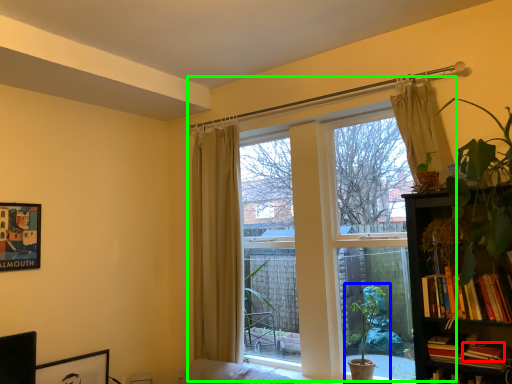
Question: Which object is positioned farthest from book (highlighted by a red box)? Select from houseplant (highlighted by a blue box) and window (highlighted by a green box).

Choices:
 (A) houseplant
 (B) window

Answer: (B)